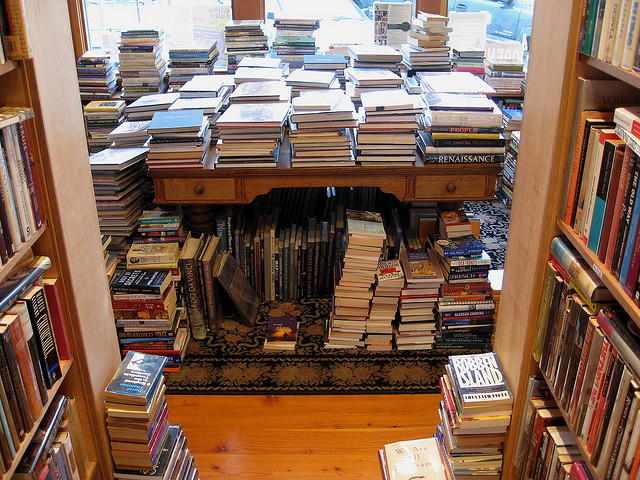
Identify the location of table. (196, 214).